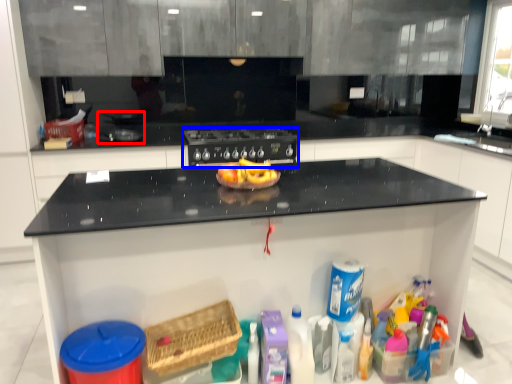
Question: Which object is closer to the camera taking this photo, appliance (highlighted by a red box) or home appliance (highlighted by a blue box)?

Choices:
 (A) appliance
 (B) home appliance

Answer: (A)